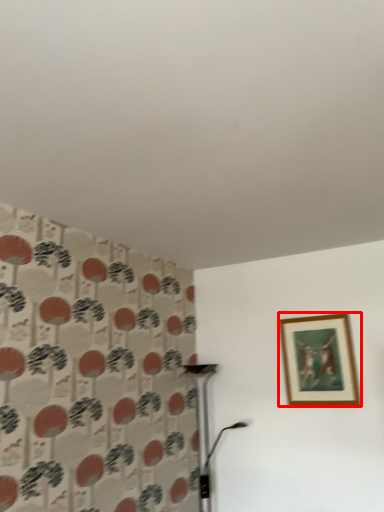
Question: From the image's perspective, where is picture frame (annotated by the red box) located in relation to table lamp in the image?

Choices:
 (A) below
 (B) above

Answer: (B)